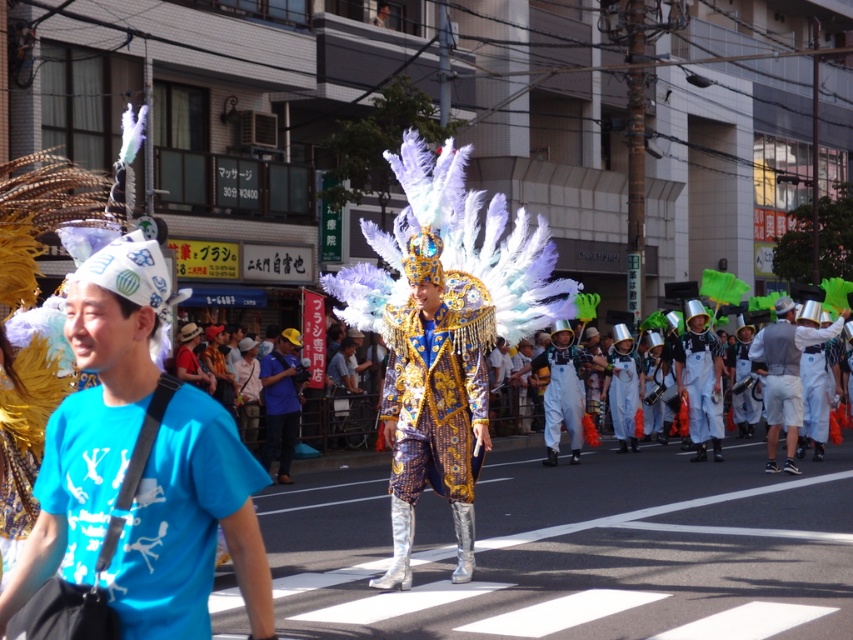
Is point (242, 481) closer to viewer compared to point (790, 464)?

Yes, point (242, 481) is in front of point (790, 464).

Who is taller, white paper hat at left or silver metallic helmet at right?

Standing taller between the two is silver metallic helmet at right.

Is point (210, 500) behind point (753, 364)?

No, (210, 500) is closer to viewer.

I want to click on white paper hat at left, so click(x=94, y=413).

The width and height of the screenshot is (853, 640). What do you see at coordinates (785, 374) in the screenshot? I see `silver metallic helmet at right` at bounding box center [785, 374].

Which is above, silver metallic helmet at right or white fabric pants at right?

silver metallic helmet at right is higher up.

Describe the element at coordinates (785, 374) in the screenshot. I see `silver metallic helmet at right` at that location.

Image resolution: width=853 pixels, height=640 pixels. Identify the location of silver metallic helmet at right. (785, 374).

Which is more to the left, blue fabric hat at center or white fabric pants at right?

Positioned to the left is blue fabric hat at center.

Is point (289, 417) farther from viewer compared to point (699, 362)?

No, (289, 417) is in front of (699, 362).

Is point (292, 444) farther from viewer compared to point (701, 429)?

No, (292, 444) is closer to viewer.

At what (x,y) coordinates should I click in order to perform the action: click on blue fabric hat at center. Please return your answer as a coordinate pair (x, y). This screenshot has height=640, width=853. Looking at the image, I should click on (281, 401).